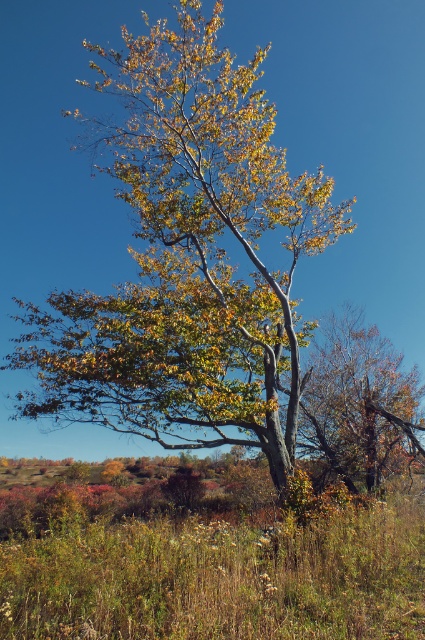
Between green grass at center and autumn leaves at center, which one is positioned lower?

green grass at center is lower down.

Is green grass at center shorter than autumn leaves at center?

Correct, green grass at center is not as tall as autumn leaves at center.

Does point (323, 627) lie in front of point (328, 465)?

Yes, point (323, 627) is closer to viewer.

Locate an element on the screen. This screenshot has width=425, height=640. green grass at center is located at coordinates (209, 561).